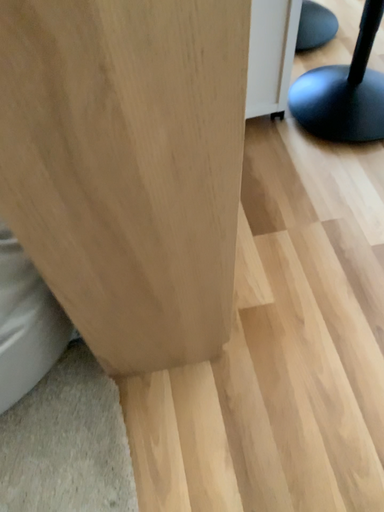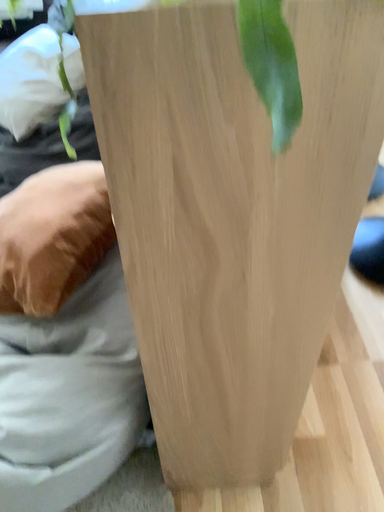
Question: Which way did the camera rotate in the video?

Choices:
 (A) rotated downward
 (B) rotated upward

Answer: (B)